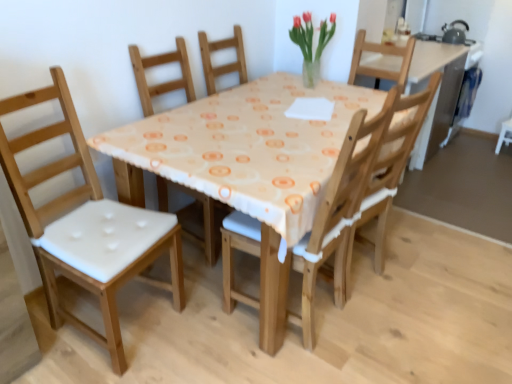
Where is `white fabric chair at left, the 1th chair when ordered from left to right`? The width and height of the screenshot is (512, 384). white fabric chair at left, the 1th chair when ordered from left to right is located at coordinates (86, 224).

Considering the relative positions of wooden chair with white cushion at center, positioned as the 1th chair in right-to-left order, and translucent glass vase at upper center in the image provided, is wooden chair with white cushion at center, positioned as the 1th chair in right-to-left order, to the left or to the right of translucent glass vase at upper center?

A: Based on their positions, wooden chair with white cushion at center, positioned as the 1th chair in right-to-left order, is located to the left of translucent glass vase at upper center.

Is there a large distance between wooden chair with white cushion at center, arranged as the 2th chair when viewed from the left, and translucent glass vase at upper center?

Absolutely, wooden chair with white cushion at center, arranged as the 2th chair when viewed from the left, is distant from translucent glass vase at upper center.

The height and width of the screenshot is (384, 512). I want to click on floral arrangement above the wooden chair with white cushion at center, positioned as the 1th chair in right-to-left order (from the image's perspective), so click(x=311, y=44).

From a real-world perspective, is wooden chair with white cushion at center, arranged as the 2th chair when viewed from the left, above or below translucent glass vase at upper center?

wooden chair with white cushion at center, arranged as the 2th chair when viewed from the left, is below translucent glass vase at upper center.

From the image's perspective, which is above, white fabric chair at left, the 2th chair viewed from the right, or translucent glass vase at upper center?

translucent glass vase at upper center.

Is the depth of white fabric chair at left, the 1th chair when ordered from left to right, greater than that of translucent glass vase at upper center?

No, white fabric chair at left, the 1th chair when ordered from left to right, is closer to the camera.

Which object is thinner, white fabric chair at left, the 1th chair when ordered from left to right, or translucent glass vase at upper center?

translucent glass vase at upper center.

Is point (46, 140) closer or farther from the camera than point (309, 35)?

Clearly, point (46, 140) is closer to the camera than point (309, 35).

Do you think translucent glass vase at upper center is within wooden chair with white cushion at center, positioned as the 1th chair in right-to-left order, or outside of it?

translucent glass vase at upper center is not enclosed by wooden chair with white cushion at center, positioned as the 1th chair in right-to-left order.

Which is more to the right, translucent glass vase at upper center or wooden chair with white cushion at center, positioned as the 1th chair in right-to-left order?

From the viewer's perspective, translucent glass vase at upper center appears more on the right side.

Is translucent glass vase at upper center wider than wooden chair with white cushion at center, arranged as the 2th chair when viewed from the left?

Incorrect, the width of translucent glass vase at upper center does not surpass that of wooden chair with white cushion at center, arranged as the 2th chair when viewed from the left.

Is wooden chair with white cushion at center, positioned as the 1th chair in right-to-left order, taller than white fabric chair at left, the 1th chair when ordered from left to right?

No.

In the scene shown: Considering the positions of objects wooden chair with white cushion at center, positioned as the 1th chair in right-to-left order, and white fabric chair at left, the 2th chair viewed from the right, in the image provided, who is more to the right, wooden chair with white cushion at center, positioned as the 1th chair in right-to-left order, or white fabric chair at left, the 2th chair viewed from the right,?

From the viewer's perspective, wooden chair with white cushion at center, positioned as the 1th chair in right-to-left order, appears more on the right side.

The width and height of the screenshot is (512, 384). I want to click on chair on the left of the wooden chair with white cushion at center, arranged as the 2th chair when viewed from the left, so click(86, 224).

Which object is closer to the camera taking this photo, wooden chair with white cushion at center, arranged as the 2th chair when viewed from the left, or white fabric chair at left, the 2th chair viewed from the right?

Positioned in front is white fabric chair at left, the 2th chair viewed from the right.

At what (x,y) coordinates should I click in order to perform the action: click on chair located underneath the white fabric chair at left, the 1th chair when ordered from left to right (from a real-world perspective). Please return your answer as a coordinate pair (x, y). Looking at the image, I should click on (313, 223).

Does white fabric chair at left, the 1th chair when ordered from left to right, contain wooden chair with white cushion at center, positioned as the 1th chair in right-to-left order?

That's incorrect, wooden chair with white cushion at center, positioned as the 1th chair in right-to-left order, is not inside white fabric chair at left, the 1th chair when ordered from left to right.

Between white fabric chair at left, the 1th chair when ordered from left to right, and wooden chair with white cushion at center, arranged as the 2th chair when viewed from the left, which one has larger size?

white fabric chair at left, the 1th chair when ordered from left to right, is bigger.

Is white fabric chair at left, the 2th chair viewed from the right, to the left of wooden chair with white cushion at center, arranged as the 2th chair when viewed from the left, from the viewer's perspective?

Correct, you'll find white fabric chair at left, the 2th chair viewed from the right, to the left of wooden chair with white cushion at center, arranged as the 2th chair when viewed from the left.

Is translucent glass vase at upper center taller than white fabric chair at left, the 1th chair when ordered from left to right?

No, translucent glass vase at upper center is not taller than white fabric chair at left, the 1th chair when ordered from left to right.

Which point is more forward, (x=310, y=39) or (x=54, y=166)?

The point (x=54, y=166) is closer to the camera.

From the picture: Considering the sizes of objects translucent glass vase at upper center and white fabric chair at left, the 2th chair viewed from the right, in the image provided, who is smaller, translucent glass vase at upper center or white fabric chair at left, the 2th chair viewed from the right,?

translucent glass vase at upper center is smaller.

Is translucent glass vase at upper center oriented towards white fabric chair at left, the 2th chair viewed from the right?

Yes, translucent glass vase at upper center faces towards white fabric chair at left, the 2th chair viewed from the right.

The height and width of the screenshot is (384, 512). I want to click on floral arrangement above the wooden chair with white cushion at center, positioned as the 1th chair in right-to-left order (from a real-world perspective), so click(311, 44).

Where is `the 2nd chair in front of the translucent glass vase at upper center`? The image size is (512, 384). the 2nd chair in front of the translucent glass vase at upper center is located at coordinates (86, 224).

In the scene shown: When comparing their distances from translucent glass vase at upper center, does wooden chair with white cushion at center, arranged as the 2th chair when viewed from the left, or white fabric chair at left, the 1th chair when ordered from left to right, seem closer?

wooden chair with white cushion at center, arranged as the 2th chair when viewed from the left, lies closer to translucent glass vase at upper center than the other object.

In the scene shown: When comparing their distances from translucent glass vase at upper center, does white fabric chair at left, the 2th chair viewed from the right, or wooden chair with white cushion at center, arranged as the 2th chair when viewed from the left, seem further?

Based on the image, white fabric chair at left, the 2th chair viewed from the right, appears to be further to translucent glass vase at upper center.

Considering their positions, is wooden chair with white cushion at center, positioned as the 1th chair in right-to-left order, positioned closer to white fabric chair at left, the 2th chair viewed from the right, than translucent glass vase at upper center?

The object closer to white fabric chair at left, the 2th chair viewed from the right, is wooden chair with white cushion at center, positioned as the 1th chair in right-to-left order.

From the image, which object appears to be nearer to white fabric chair at left, the 2th chair viewed from the right, translucent glass vase at upper center or wooden chair with white cushion at center, arranged as the 2th chair when viewed from the left?

Based on the image, wooden chair with white cushion at center, arranged as the 2th chair when viewed from the left, appears to be nearer to white fabric chair at left, the 2th chair viewed from the right.

Looking at the image, which one is located closer to wooden chair with white cushion at center, positioned as the 1th chair in right-to-left order, translucent glass vase at upper center or white fabric chair at left, the 2th chair viewed from the right?

white fabric chair at left, the 2th chair viewed from the right, is closer to wooden chair with white cushion at center, positioned as the 1th chair in right-to-left order.

From the image, which object appears to be farther from wooden chair with white cushion at center, positioned as the 1th chair in right-to-left order, white fabric chair at left, the 2th chair viewed from the right, or translucent glass vase at upper center?

translucent glass vase at upper center is further to wooden chair with white cushion at center, positioned as the 1th chair in right-to-left order.

Locate an element on the screen. chair located between white fabric chair at left, the 1th chair when ordered from left to right, and translucent glass vase at upper center in the depth direction is located at coordinates (313, 223).